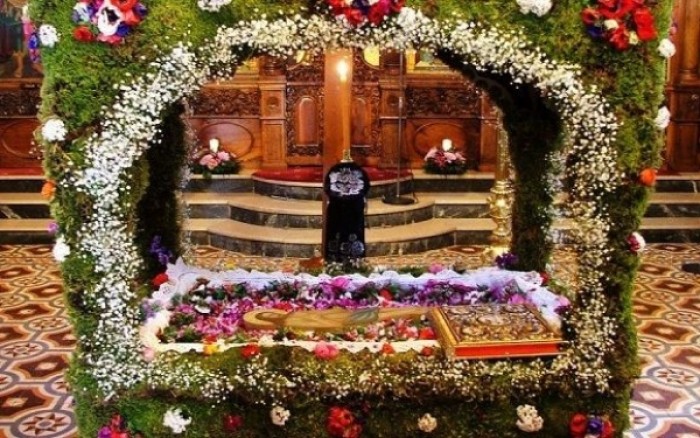
This screenshot has height=438, width=700. Identify the location of altar. (355, 116).